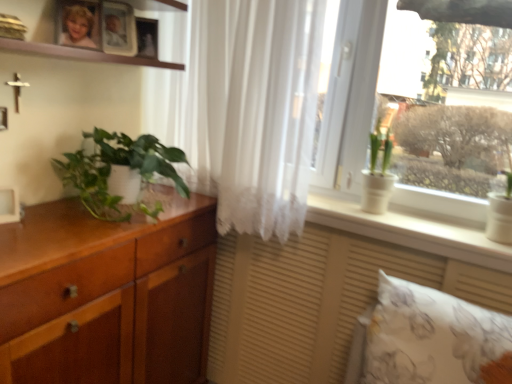
Question: Considering the relative positions of white matte picture frame at left, the 3th picture frame viewed from the top, and white sheer curtain at center in the image provided, is white matte picture frame at left, the 3th picture frame viewed from the top, to the right of white sheer curtain at center from the viewer's perspective?

Choices:
 (A) no
 (B) yes

Answer: (A)

Question: Can you confirm if white matte picture frame at left, which is the 1th picture frame from left to right, is positioned to the left of white sheer curtain at center?

Choices:
 (A) yes
 (B) no

Answer: (A)

Question: Is white matte picture frame at left, the 3th picture frame viewed from the top, shorter than white sheer curtain at center?

Choices:
 (A) yes
 (B) no

Answer: (A)

Question: From the image's perspective, is white matte picture frame at left, the third picture frame from the back, above white sheer curtain at center?

Choices:
 (A) no
 (B) yes

Answer: (A)

Question: Is white matte picture frame at left, the 1th picture frame ordered from the bottom, looking in the opposite direction of white sheer curtain at center?

Choices:
 (A) no
 (B) yes

Answer: (A)

Question: Considering the positions of white ceramic pot at window, positioned as the first houseplant in right-to-left order, and white matte picture frame at left, which ranks as the third picture frame in right-to-left order, in the image, is white ceramic pot at window, positioned as the first houseplant in right-to-left order, wider or thinner than white matte picture frame at left, which ranks as the third picture frame in right-to-left order,?

Choices:
 (A) wide
 (B) thin

Answer: (A)

Question: From the image's perspective, relative to white matte picture frame at left, marked as the first picture frame in a front-to-back arrangement, is white ceramic pot at window, the second houseplant when ordered from left to right, above or below?

Choices:
 (A) above
 (B) below

Answer: (A)

Question: Relative to white matte picture frame at left, the third picture frame from the back, is white ceramic pot at window, positioned as the first houseplant in right-to-left order, in front or behind?

Choices:
 (A) front
 (B) behind

Answer: (B)

Question: In terms of height, does white ceramic pot at window, positioned as the first houseplant in right-to-left order, look taller or shorter compared to white matte picture frame at left, which is the 1th picture frame from left to right?

Choices:
 (A) tall
 (B) short

Answer: (A)

Question: From the image's perspective, relative to white ceramic pot at window, the second houseplant when ordered from left to right, is matte wood vanity at lower center above or below?

Choices:
 (A) below
 (B) above

Answer: (A)

Question: From a real-world perspective, is matte wood vanity at lower center above or below white ceramic pot at window, positioned as the first houseplant in right-to-left order?

Choices:
 (A) above
 (B) below

Answer: (B)

Question: Is matte wood vanity at lower center in front of or behind white ceramic pot at window, the second houseplant when ordered from left to right, in the image?

Choices:
 (A) front
 (B) behind

Answer: (A)

Question: Visually, is matte wood vanity at lower center positioned to the left or to the right of white ceramic pot at window, positioned as the first houseplant in right-to-left order?

Choices:
 (A) right
 (B) left

Answer: (B)

Question: Is white sheer curtain at center wider or thinner than blonde hair photo at upper left?

Choices:
 (A) wide
 (B) thin

Answer: (A)

Question: Would you say white sheer curtain at center is to the left or to the right of blonde hair photo at upper left in the picture?

Choices:
 (A) right
 (B) left

Answer: (A)